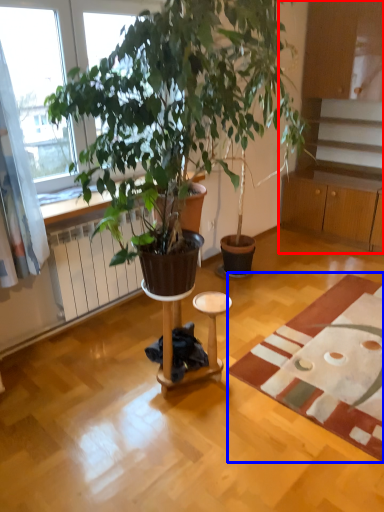
Question: Which object appears closest to the camera in this image, cabinetry (highlighted by a red box) or mat (highlighted by a blue box)?

Choices:
 (A) cabinetry
 (B) mat

Answer: (B)